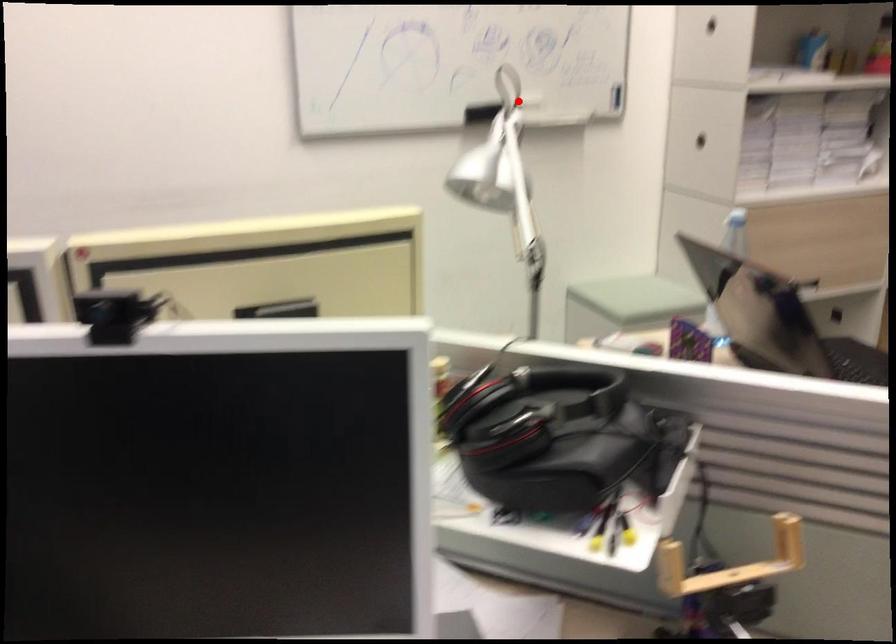
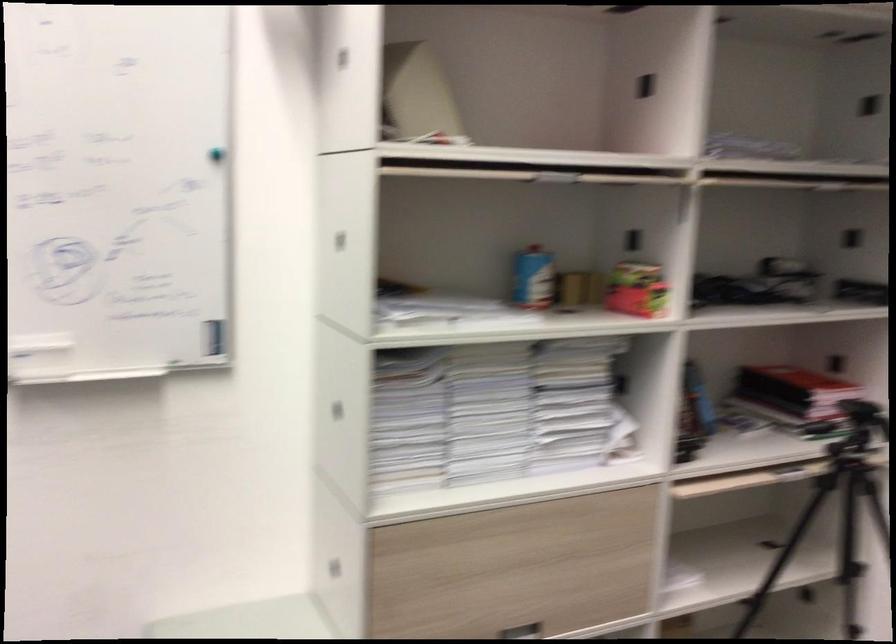
Question: I am providing you with two images of the same scene from different viewpoints. A red point is shown in image1. For the corresponding object point in image2, is it positioned nearer or farther from the camera?

Choices:
 (A) Nearer
 (B) Farther

Answer: (A)